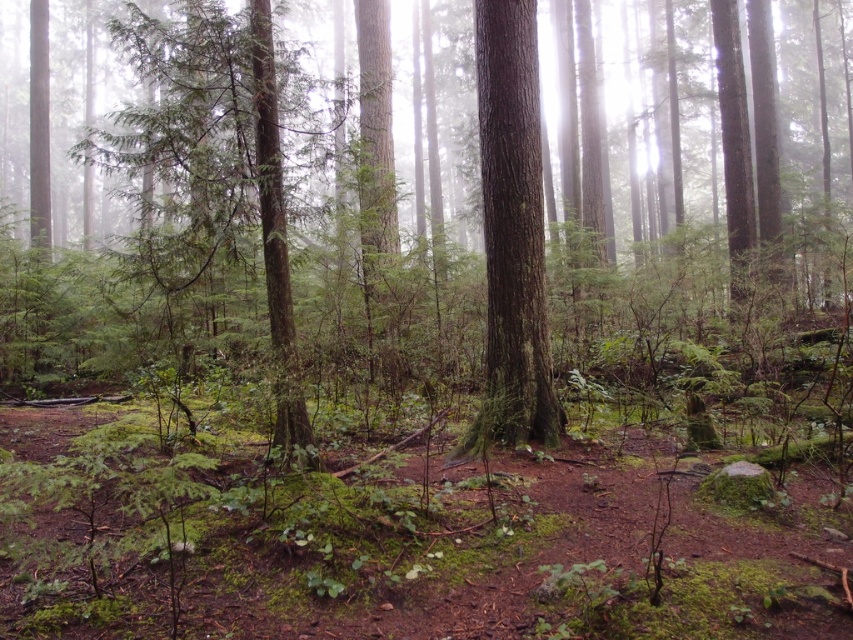
You are a hiker trying to navigate through the misty forest. You notice a green matte tree at center and a smooth brown tree trunk at center. Which object would you see first if you were looking directly at the center of the scene?

The green matte tree at center is located above the smooth brown tree trunk at center, so you would see the green matte tree at center first when looking directly at the center of the scene.

You are a hiker trying to navigate through the forest. You need to pass between the green matte tree at center and the smooth brown tree trunk at center. Can you walk through the space between them?

The green matte tree at center is wider than the smooth brown tree trunk at center, so the space between them may be narrow. However, without knowing the exact distance between the trees, it is uncertain if there is enough space to walk through safely.